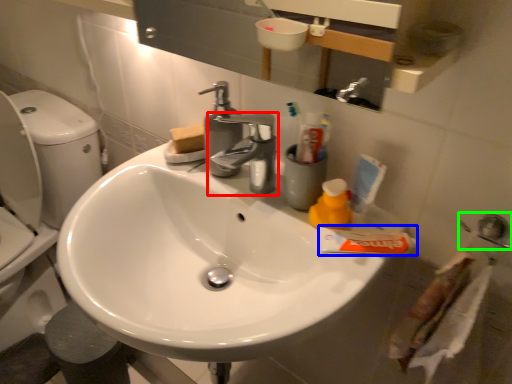
Question: Which object is positioned closest to tap (highlighted by a red box)? Select from toothpaste (highlighted by a blue box) and plumbing fixture (highlighted by a green box).

Choices:
 (A) toothpaste
 (B) plumbing fixture

Answer: (A)